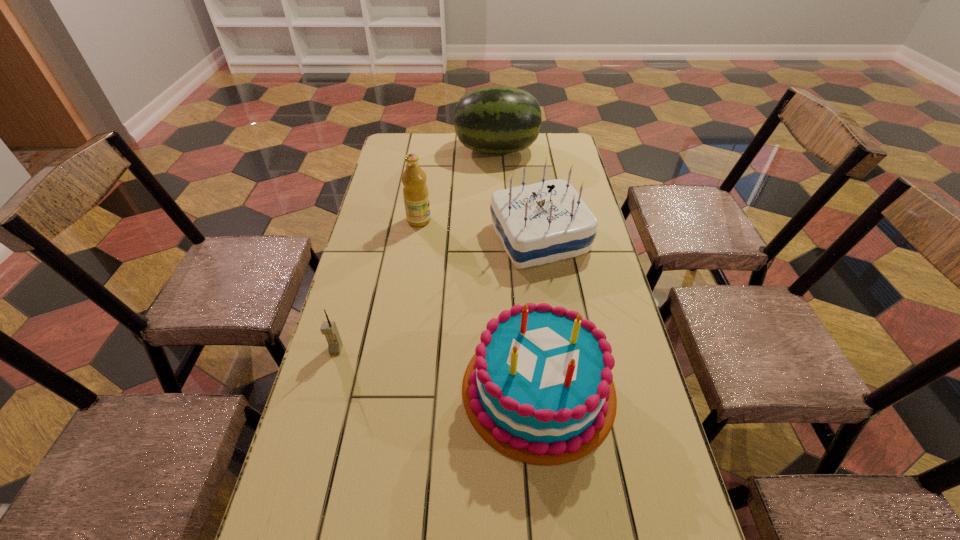
Identify the location of vacant area situated 0.070m on the front of the cellular telephone, where the keypad is located. The width and height of the screenshot is (960, 540). (328, 379).

Locate an element on the screen. object present at the far edge is located at coordinates (498, 119).

The height and width of the screenshot is (540, 960). Find the location of `olive oil that is at the left edge`. olive oil that is at the left edge is located at coordinates (415, 191).

Identify the location of cellular telephone present at the left edge. (328, 328).

The image size is (960, 540). I want to click on watermelon at the right edge, so click(498, 119).

The image size is (960, 540). Find the location of `object present at the far right corner`. object present at the far right corner is located at coordinates [498, 119].

At what (x,y) coordinates should I click in order to perform the action: click on vacant space at the far edge. Please return your answer as a coordinate pair (x, y). The image size is (960, 540). Looking at the image, I should click on 517,152.

Locate an element on the screen. The width and height of the screenshot is (960, 540). vacant region at the left edge of the desktop is located at coordinates (329, 473).

This screenshot has width=960, height=540. Identify the location of vacant area at the right edge of the desktop. (631, 360).

You are a GUI agent. You are given a task and a screenshot of the screen. Output one action in this format:
    pyautogui.click(x=<x>, y=<y>)
    Task: Click on the free space at the far left corner
    
    Given the screenshot: What is the action you would take?
    pyautogui.click(x=427, y=138)